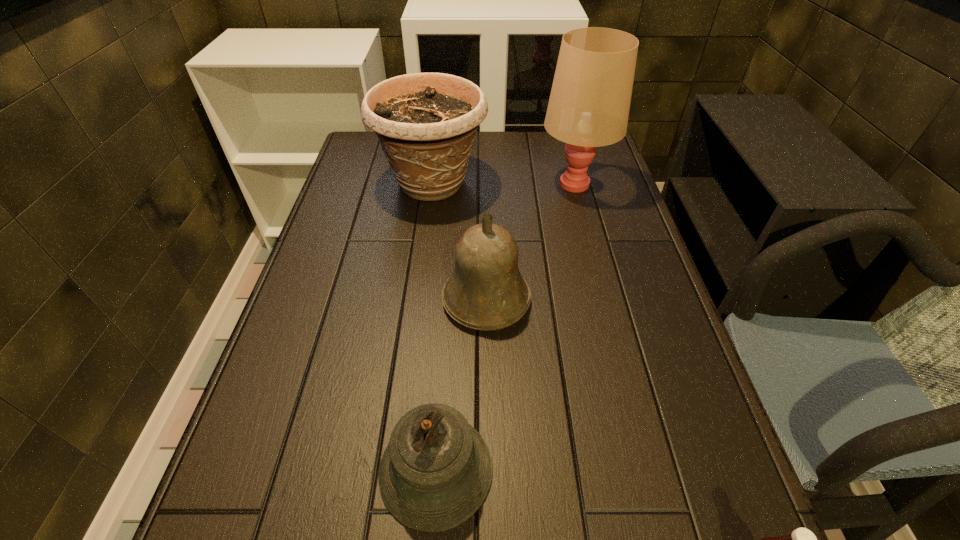
This screenshot has height=540, width=960. Identify the location of vacant area that lies between the flowerpot and the fourth farthest object. (434, 326).

Where is `unoccupied area between the tallest object and the third nearest object`? The width and height of the screenshot is (960, 540). unoccupied area between the tallest object and the third nearest object is located at coordinates (531, 241).

Locate an element on the screen. object that stands as the closest to the third farthest object is located at coordinates (436, 471).

At what (x,y) coordinates should I click in order to perform the action: click on object that is the second closest to the nearest object. Please return your answer as a coordinate pair (x, y). The image size is (960, 540). Looking at the image, I should click on (486, 291).